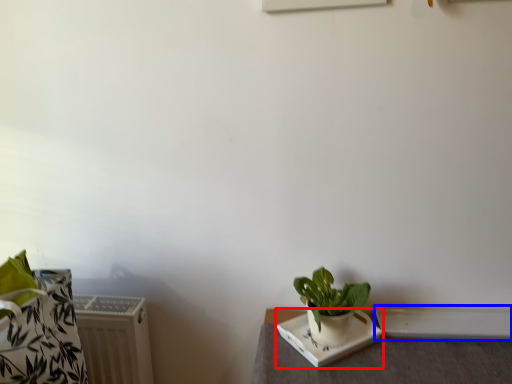
Question: Which point is closer to the camera, plate (highlighted by a red box) or window sill (highlighted by a blue box)?

Choices:
 (A) plate
 (B) window sill

Answer: (A)